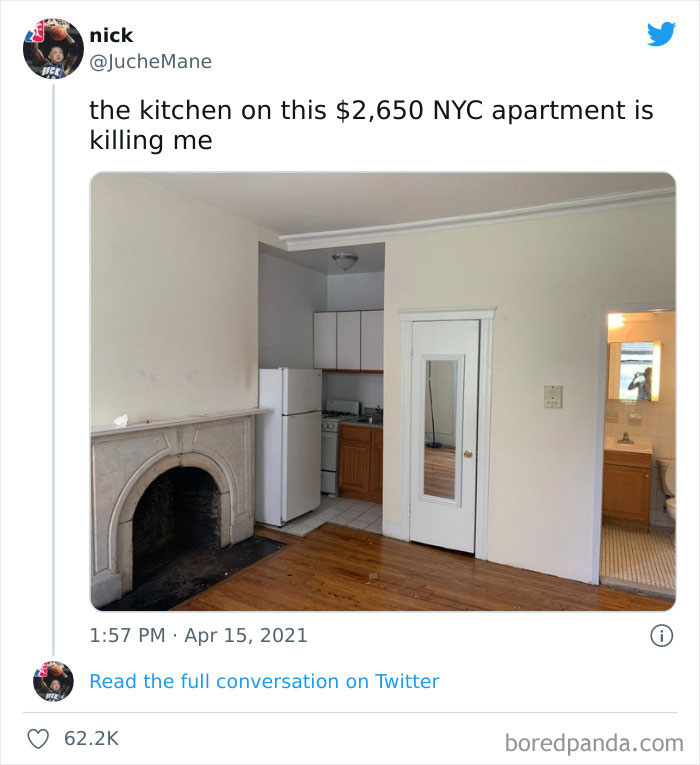
The height and width of the screenshot is (765, 700). Identify the location of oven. (332, 425).